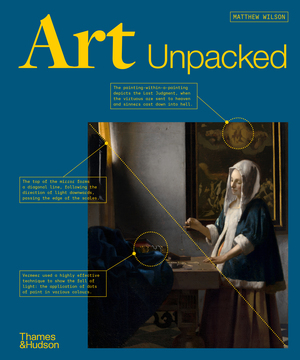
What are the coordinates of `oil painting` in the screenshot? It's located at click(x=211, y=152).